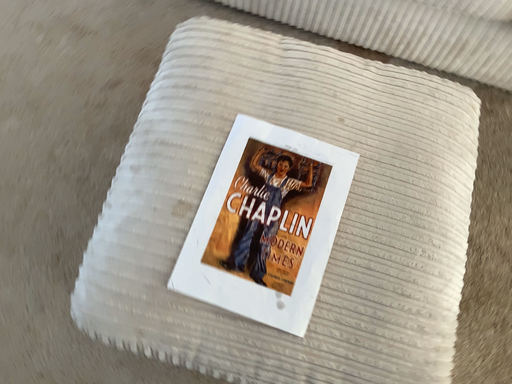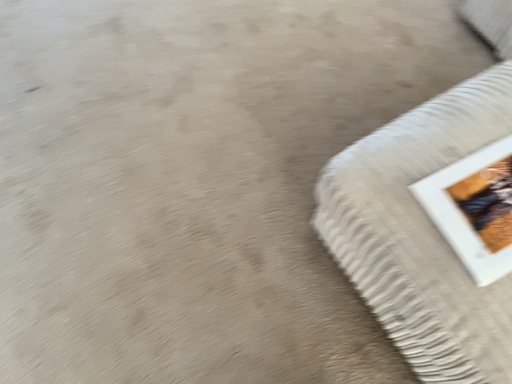
Question: How did the camera likely rotate when shooting the video?

Choices:
 (A) rotated upward
 (B) rotated downward

Answer: (A)